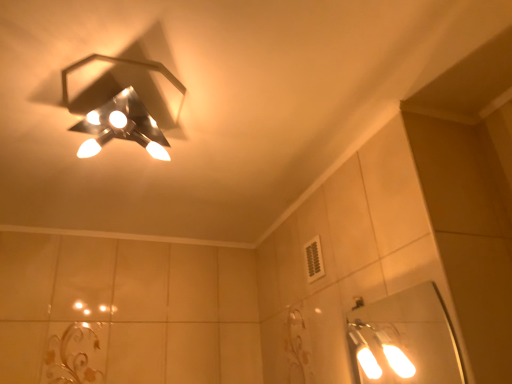
Question: Is white glossy mirror at lower right in front of or behind metallic hexagonal light fixture at upper left in the image?

Choices:
 (A) behind
 (B) front

Answer: (A)

Question: Considering the positions of white glossy mirror at lower right and metallic hexagonal light fixture at upper left in the image, is white glossy mirror at lower right bigger or smaller than metallic hexagonal light fixture at upper left?

Choices:
 (A) big
 (B) small

Answer: (B)

Question: In terms of height, does white glossy mirror at lower right look taller or shorter compared to metallic hexagonal light fixture at upper left?

Choices:
 (A) short
 (B) tall

Answer: (B)

Question: Looking at the image, does metallic hexagonal light fixture at upper left seem bigger or smaller compared to white glossy mirror at lower right?

Choices:
 (A) big
 (B) small

Answer: (A)

Question: Is metallic hexagonal light fixture at upper left wider or thinner than white glossy mirror at lower right?

Choices:
 (A) wide
 (B) thin

Answer: (A)

Question: Is metallic hexagonal light fixture at upper left in front of or behind white glossy mirror at lower right in the image?

Choices:
 (A) front
 (B) behind

Answer: (A)

Question: From their relative heights in the image, would you say metallic hexagonal light fixture at upper left is taller or shorter than white glossy mirror at lower right?

Choices:
 (A) short
 (B) tall

Answer: (A)